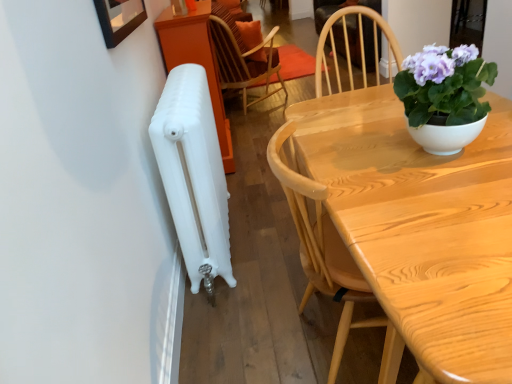
Question: Can you confirm if white matte radiator at left is smaller than light wood table at center?

Choices:
 (A) no
 (B) yes

Answer: (B)

Question: From the image's perspective, would you say white matte radiator at left is shown under light wood table at center?

Choices:
 (A) yes
 (B) no

Answer: (B)

Question: From a real-world perspective, does white matte radiator at left stand above light wood table at center?

Choices:
 (A) yes
 (B) no

Answer: (A)

Question: Does white matte radiator at left have a larger size compared to light wood table at center?

Choices:
 (A) no
 (B) yes

Answer: (A)

Question: Does white matte radiator at left have a lesser height compared to light wood table at center?

Choices:
 (A) yes
 (B) no

Answer: (B)

Question: Does white matte radiator at left appear on the right side of light wood table at center?

Choices:
 (A) yes
 (B) no

Answer: (B)

Question: Can you confirm if purple glossy plant at upper right is smaller than light wood table at center?

Choices:
 (A) yes
 (B) no

Answer: (A)

Question: Is purple glossy plant at upper right far away from light wood table at center?

Choices:
 (A) yes
 (B) no

Answer: (B)

Question: Is purple glossy plant at upper right wider than light wood table at center?

Choices:
 (A) yes
 (B) no

Answer: (B)

Question: From a real-world perspective, is purple glossy plant at upper right below light wood table at center?

Choices:
 (A) no
 (B) yes

Answer: (A)

Question: Does purple glossy plant at upper right have a lesser width compared to light wood table at center?

Choices:
 (A) yes
 (B) no

Answer: (A)

Question: Considering the relative positions of purple glossy plant at upper right and light wood table at center in the image provided, is purple glossy plant at upper right behind light wood table at center?

Choices:
 (A) no
 (B) yes

Answer: (B)

Question: Is wooden chair at upper center oriented away from purple glossy plant at upper right?

Choices:
 (A) no
 (B) yes

Answer: (A)